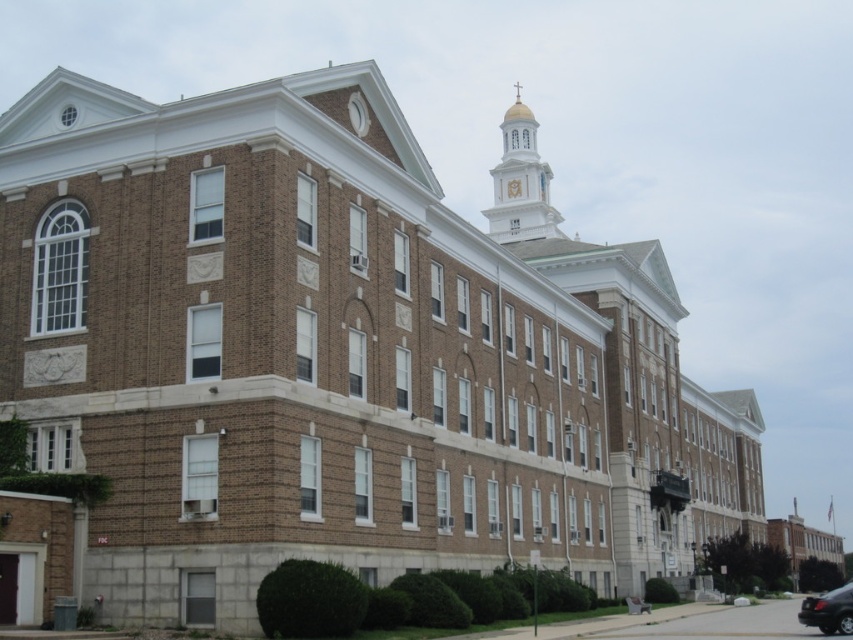
Question: Is the position of white glossy bell tower at upper center less distant than that of shiny black car at lower right?

Choices:
 (A) no
 (B) yes

Answer: (A)

Question: Which object appears closest to the camera in this image?

Choices:
 (A) shiny black car at lower right
 (B) white glossy bell tower at upper center

Answer: (A)

Question: Does white glossy bell tower at upper center appear on the left side of shiny black car at lower right?

Choices:
 (A) yes
 (B) no

Answer: (A)

Question: Is white glossy bell tower at upper center bigger than shiny black car at lower right?

Choices:
 (A) yes
 (B) no

Answer: (A)